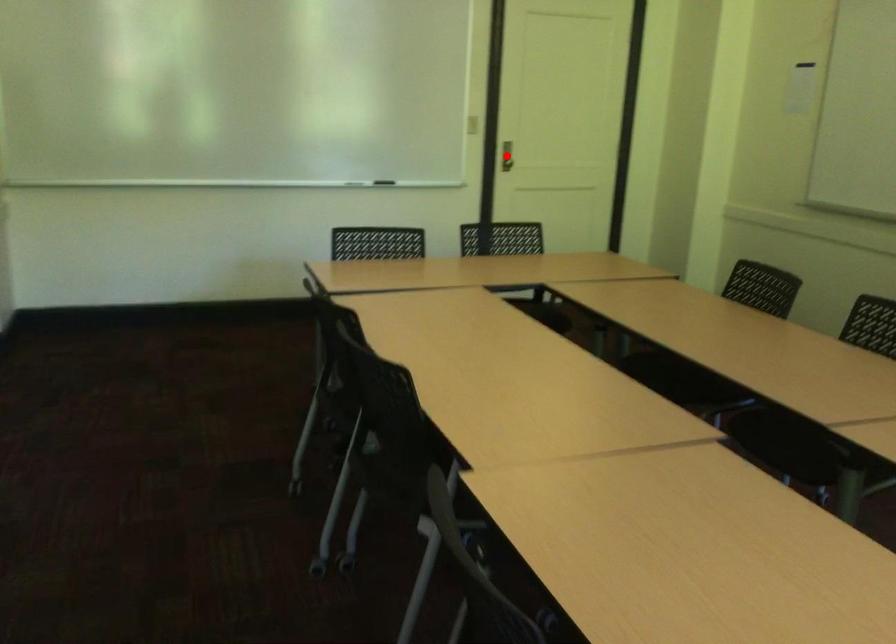
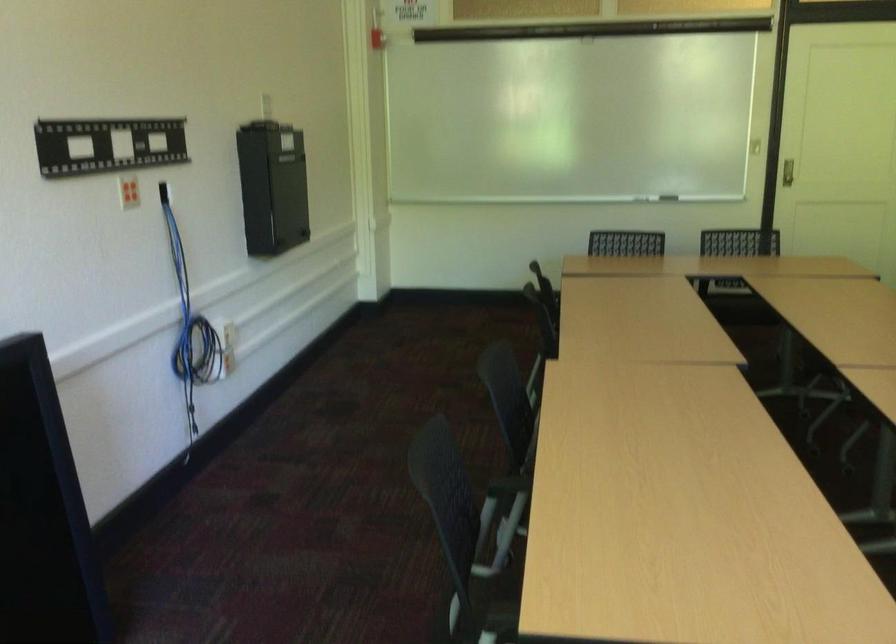
Question: I am providing you with two images of the same scene from different viewpoints. A red point is marked on the first image. At the location where the point appears in image 1, is it still visible in image 2?

Choices:
 (A) Yes
 (B) No

Answer: (B)